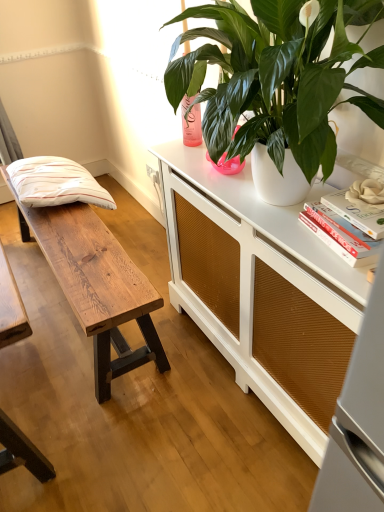
Question: Considering the relative sizes of white matte flower at upper right and white striped pillow at left in the image provided, is white matte flower at upper right bigger than white striped pillow at left?

Choices:
 (A) no
 (B) yes

Answer: (A)

Question: Is white matte flower at upper right wider than white striped pillow at left?

Choices:
 (A) no
 (B) yes

Answer: (A)

Question: Would you say white matte flower at upper right is a long distance from white striped pillow at left?

Choices:
 (A) no
 (B) yes

Answer: (B)

Question: Does white matte flower at upper right have a lesser height compared to white striped pillow at left?

Choices:
 (A) yes
 (B) no

Answer: (A)

Question: Is white matte flower at upper right smaller than white striped pillow at left?

Choices:
 (A) no
 (B) yes

Answer: (B)

Question: In the image, is white textured cabinet at center positioned in front of or behind wooden bench at left?

Choices:
 (A) front
 (B) behind

Answer: (A)

Question: From a real-world perspective, is white textured cabinet at center positioned above or below wooden bench at left?

Choices:
 (A) below
 (B) above

Answer: (B)

Question: Considering the positions of white textured cabinet at center and wooden bench at left in the image, is white textured cabinet at center bigger or smaller than wooden bench at left?

Choices:
 (A) big
 (B) small

Answer: (A)

Question: Is point (220, 260) positioned closer to the camera than point (104, 321)?

Choices:
 (A) farther
 (B) closer

Answer: (A)

Question: Does point (352, 259) appear closer or farther from the camera than point (379, 221)?

Choices:
 (A) closer
 (B) farther

Answer: (A)

Question: In terms of height, does white matte book at upper right, the 2th book from the top, look taller or shorter compared to white matte book at upper right, the first book positioned from the top?

Choices:
 (A) short
 (B) tall

Answer: (A)

Question: Do you think white matte book at upper right, the 2th book from the top, is within white matte book at upper right, the first book positioned from the top, or outside of it?

Choices:
 (A) inside
 (B) outside

Answer: (B)

Question: Considering the positions of white matte book at upper right, the 2th book from the top, and white matte book at upper right, the 2th book positioned from the bottom, in the image, is white matte book at upper right, the 2th book from the top, bigger or smaller than white matte book at upper right, the 2th book positioned from the bottom,?

Choices:
 (A) big
 (B) small

Answer: (A)

Question: Do you think white matte flower at upper right is within white striped pillow at left, or outside of it?

Choices:
 (A) outside
 (B) inside

Answer: (A)

Question: From the image's perspective, is white matte flower at upper right positioned above or below white striped pillow at left?

Choices:
 (A) above
 (B) below

Answer: (B)